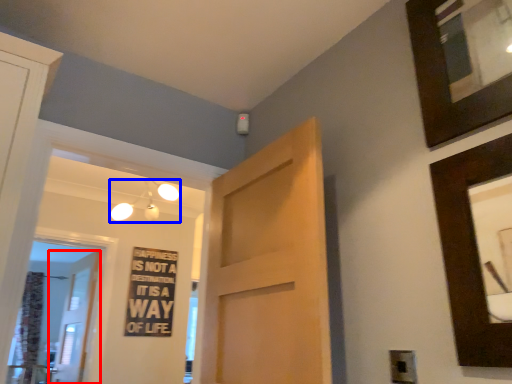
Question: Which point is further to the camera, door (highlighted by a red box) or light fixture (highlighted by a blue box)?

Choices:
 (A) door
 (B) light fixture

Answer: (A)